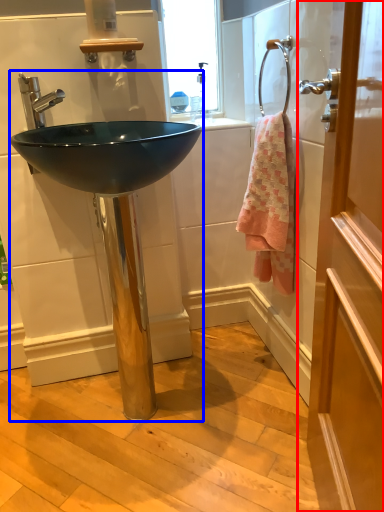
Question: Which point is closer to the camera, door (highlighted by a red box) or sink (highlighted by a blue box)?

Choices:
 (A) door
 (B) sink

Answer: (A)